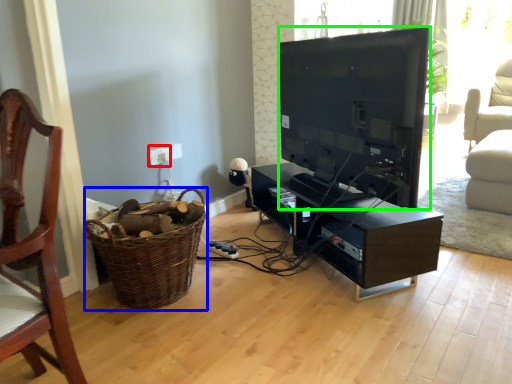
Question: Which object is positioned closest to electric outlet (highlighted by a red box)? Select from basket (highlighted by a blue box) and television (highlighted by a green box).

Choices:
 (A) basket
 (B) television

Answer: (A)